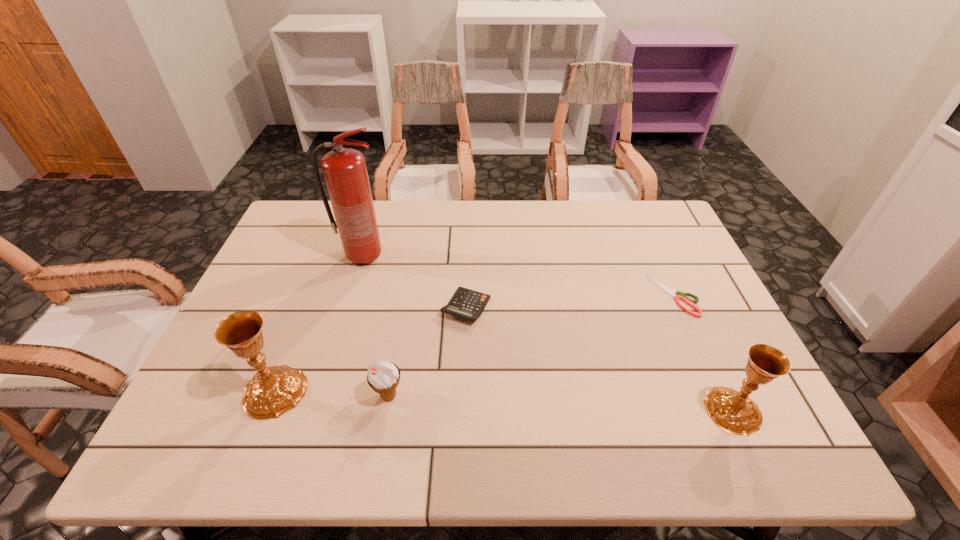
Locate an element on the screen. The height and width of the screenshot is (540, 960). the third shortest object is located at coordinates (383, 377).

The image size is (960, 540). What are the coordinates of `free space located on the back of the taller chalice` in the screenshot? It's located at (321, 274).

Locate an element on the screen. This screenshot has width=960, height=540. vacant region located on the left of the shorter chalice is located at coordinates (564, 410).

The height and width of the screenshot is (540, 960). I want to click on blank space located on the left of the fifth tallest object, so (x=397, y=307).

Identify the location of vacant space located on the handle side the tallest object. (462, 256).

I want to click on vacant space located 0.180m on the left of the shortest object, so click(588, 296).

Identify the location of free spot located 0.320m on the right of the icecream. (546, 396).

The width and height of the screenshot is (960, 540). Identify the location of icecream at the near edge. (383, 377).

Find the location of `object present at the left edge`. object present at the left edge is located at coordinates (274, 390).

Find the location of a particular element. chalice present at the right edge is located at coordinates (733, 411).